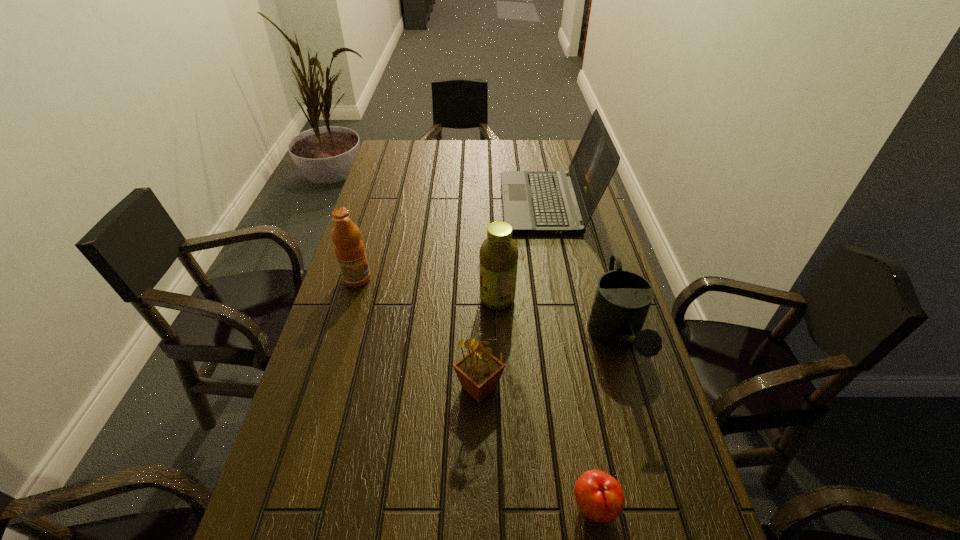
Locate an element on the screen. This screenshot has height=540, width=960. the farthest object is located at coordinates (547, 202).

At what (x,y) coordinates should I click in order to perform the action: click on the right fruit juice. Please return your answer as a coordinate pair (x, y). Looking at the image, I should click on (498, 255).

The height and width of the screenshot is (540, 960). In order to click on the leftmost object in this screenshot , I will do `click(349, 249)`.

This screenshot has width=960, height=540. Identify the location of sunflower. (479, 371).

The width and height of the screenshot is (960, 540). In order to click on watering can in this screenshot , I will do [622, 299].

Where is `the nearest object`? The image size is (960, 540). the nearest object is located at coordinates (599, 496).

The image size is (960, 540). In order to click on the shortest object in this screenshot , I will do `click(599, 496)`.

Image resolution: width=960 pixels, height=540 pixels. Identify the location of free space located 0.050m on the screen of the laptop_computer. (488, 204).

Where is `free space located on the screen of the laptop_computer`? The image size is (960, 540). free space located on the screen of the laptop_computer is located at coordinates (457, 204).

Where is `free space located 0.110m on the screen of the laptop_computer`? free space located 0.110m on the screen of the laptop_computer is located at coordinates (471, 204).